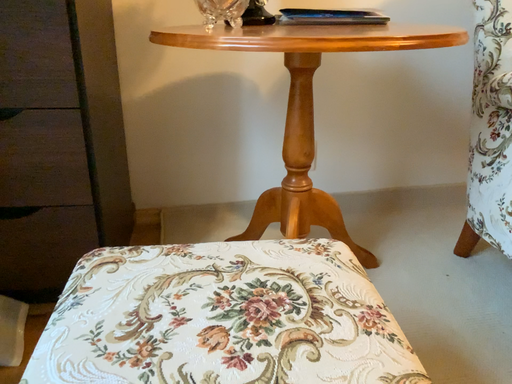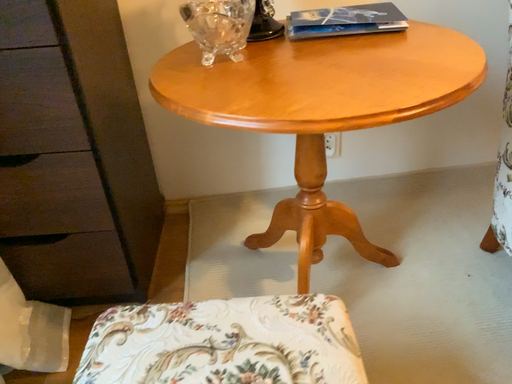
Question: How did the camera likely rotate when shooting the video?

Choices:
 (A) rotated upward
 (B) rotated downward

Answer: (B)